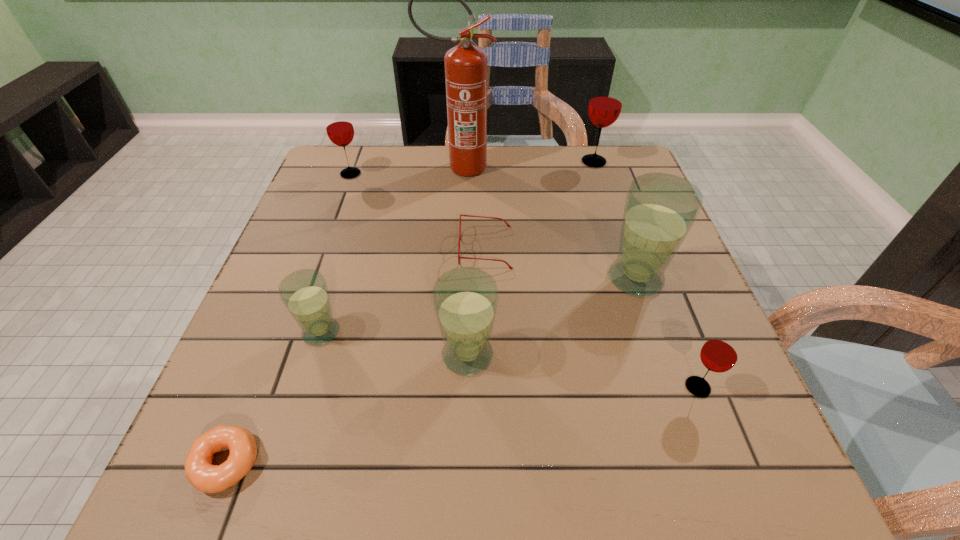
At what (x,y) coordinates should I click in order to perform the action: click on the third closest blue glass to the red fire extinguisher. Please return your answer as a coordinate pair (x, y). This screenshot has height=540, width=960. Looking at the image, I should click on (465, 299).

Locate an element on the screen. The image size is (960, 540). the closest blue glass to the tallest object is located at coordinates (660, 209).

Locate an element on the screen. This screenshot has width=960, height=540. vacant area in the image that satisfies the following two spatial constraints: 1. from the nozzle of the nearest red glass; 2. on the left side of the tallest object is located at coordinates (445, 387).

Where is `free space in the image that satisfies the following two spatial constraints: 1. on the back side of the biggest red glass; 2. on the right side of the leftmost blue glass`? The width and height of the screenshot is (960, 540). free space in the image that satisfies the following two spatial constraints: 1. on the back side of the biggest red glass; 2. on the right side of the leftmost blue glass is located at coordinates (374, 162).

You are a GUI agent. You are given a task and a screenshot of the screen. Output one action in this format:
    pyautogui.click(x=<x>, y=<y>)
    Task: Click on the vacant region that satisfies the following two spatial constraints: 1. on the face of the smallest red glass; 2. on the right side of the spectacles
    The width and height of the screenshot is (960, 540).
    Given the screenshot: What is the action you would take?
    pyautogui.click(x=488, y=387)

You are a GUI agent. You are given a task and a screenshot of the screen. Output one action in this format:
    pyautogui.click(x=<x>, y=<y>)
    Task: Click on the vacant area in the image that satisfies the following two spatial constraints: 1. on the face of the fourth nearest glass; 2. on the left side of the eighth tallest object
    The height and width of the screenshot is (540, 960).
    Given the screenshot: What is the action you would take?
    pyautogui.click(x=486, y=279)